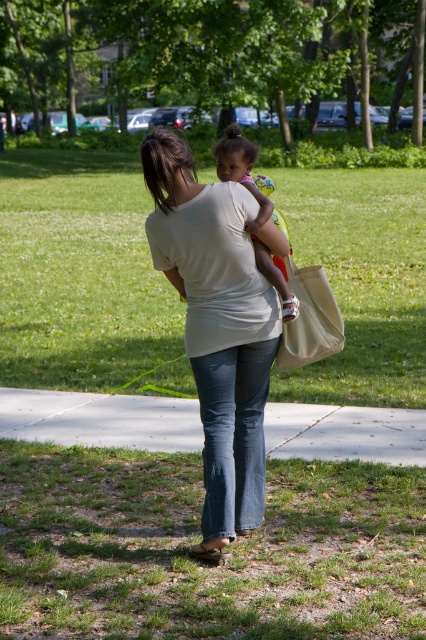
You are a photographer trying to capture a candid shot of the white matte shirt at center without including the green grass at lower center in the frame. Is this possible given their positions?

The green grass at lower center is positioned under the white matte shirt at center, so it is likely blocking the grass from view. Therefore, you can capture the white matte shirt at center without including the green grass at lower center in the frame.

You are standing at the point with coordinates point (261, 368) and want to walk towards the point (371, 484). Which direction should you face to move towards it?

Since point (371, 484) is further to the viewer than point (261, 368), you should face away from the camera to move towards it.